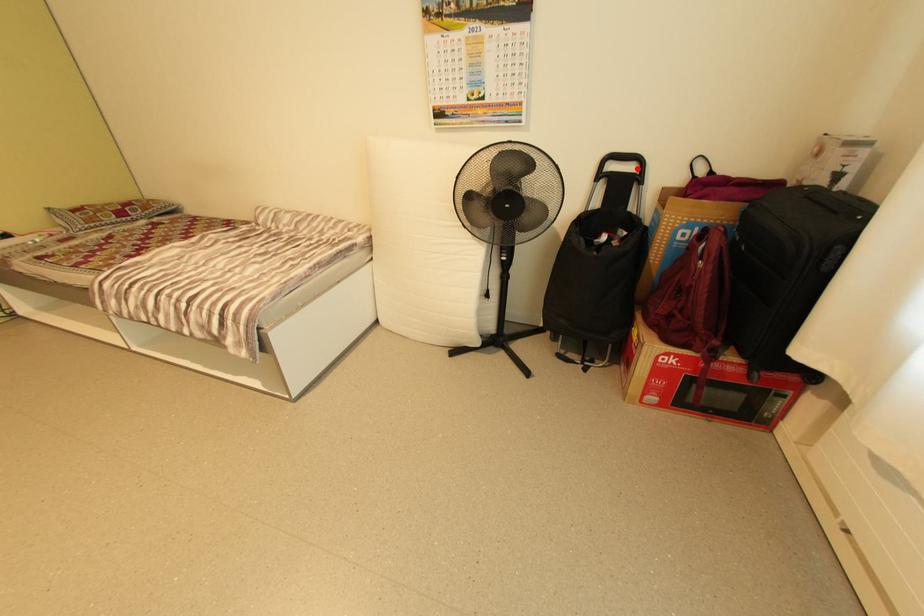
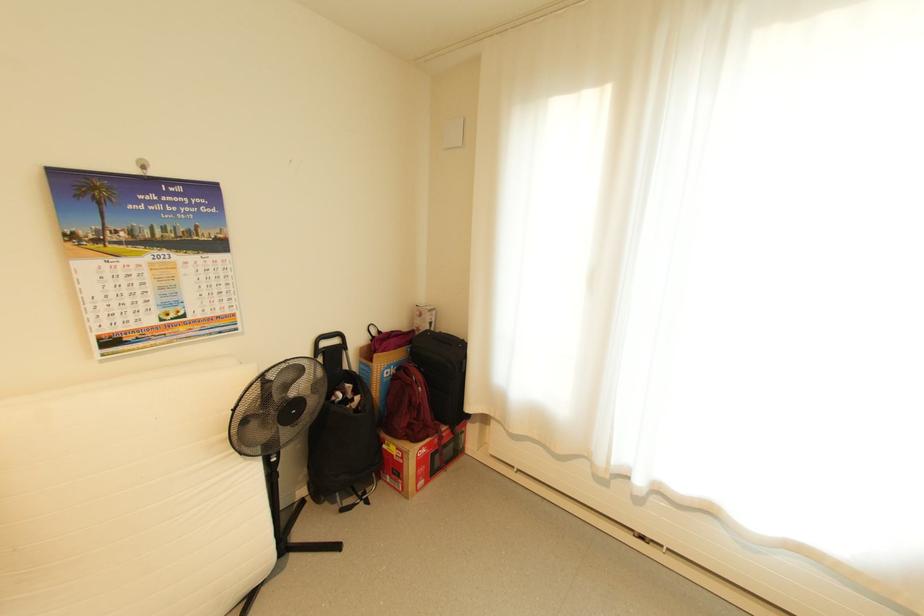
Where in the second image is the point corresponding to the highlighted location from the first image?

(342, 342)